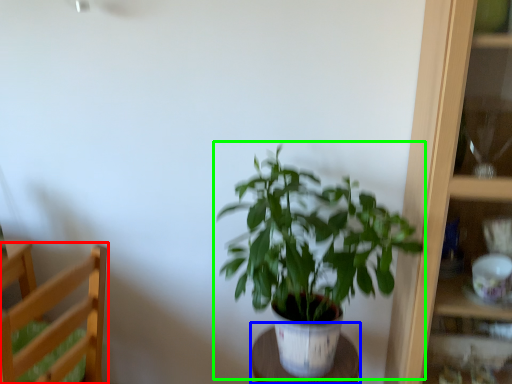
Question: Which object is positioned closest to furniture (highlighted by a red box)? Select from table (highlighted by a blue box) and houseplant (highlighted by a green box).

Choices:
 (A) table
 (B) houseplant

Answer: (B)